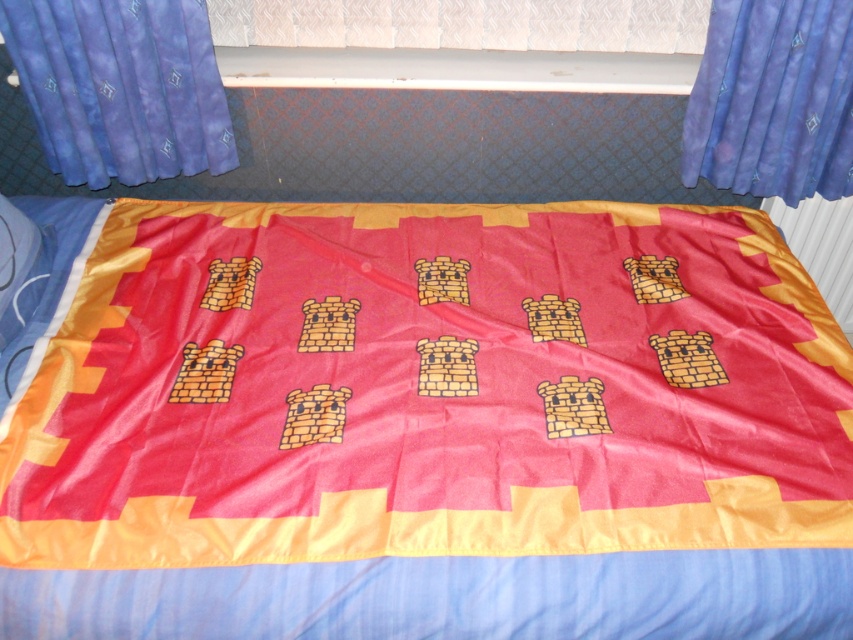
Is point (788, 358) positioned before point (148, 17)?

Yes, it is in front of point (148, 17).

Between satin red quilt at center and blue fabric curtain at upper left, which one appears on the right side from the viewer's perspective?

From the viewer's perspective, satin red quilt at center appears more on the right side.

Which is in front, point (257, 378) or point (200, 52)?

Point (257, 378) is more forward.

You are a GUI agent. You are given a task and a screenshot of the screen. Output one action in this format:
    pyautogui.click(x=<x>, y=<y>)
    Task: Click on the satin red quilt at center
    This screenshot has height=640, width=853.
    Given the screenshot: What is the action you would take?
    pyautogui.click(x=422, y=426)

Where is `satin red quilt at center`? The width and height of the screenshot is (853, 640). satin red quilt at center is located at coordinates (422, 426).

Is point (401, 628) closer to camera compared to point (722, 0)?

Yes.

Does point (155, 352) come closer to viewer compared to point (769, 156)?

Yes, it is in front of point (769, 156).

You are a GUI agent. You are given a task and a screenshot of the screen. Output one action in this format:
    pyautogui.click(x=<x>, y=<y>)
    Task: Click on the satin red quilt at center
    
    Given the screenshot: What is the action you would take?
    pyautogui.click(x=422, y=426)

Does point (199, 138) come in front of point (744, 12)?

That is False.

Between blue fabric curtain at upper left and blue satin curtain at upper right, which one appears on the left side from the viewer's perspective?

Positioned to the left is blue fabric curtain at upper left.

Is point (45, 17) more distant than point (689, 99)?

No, it is in front of (689, 99).

You are a GUI agent. You are given a task and a screenshot of the screen. Output one action in this format:
    pyautogui.click(x=<x>, y=<y>)
    Task: Click on the blue fabric curtain at upper left
    This screenshot has height=640, width=853.
    Given the screenshot: What is the action you would take?
    pyautogui.click(x=120, y=86)